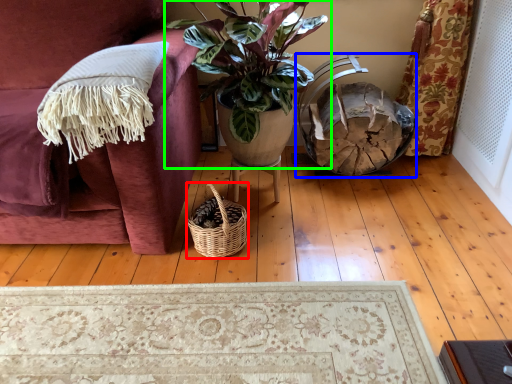
Question: Which is nearer to the picnic basket (highlighted by a red box)? rocking chair (highlighted by a blue box) or houseplant (highlighted by a green box).

Choices:
 (A) rocking chair
 (B) houseplant

Answer: (B)